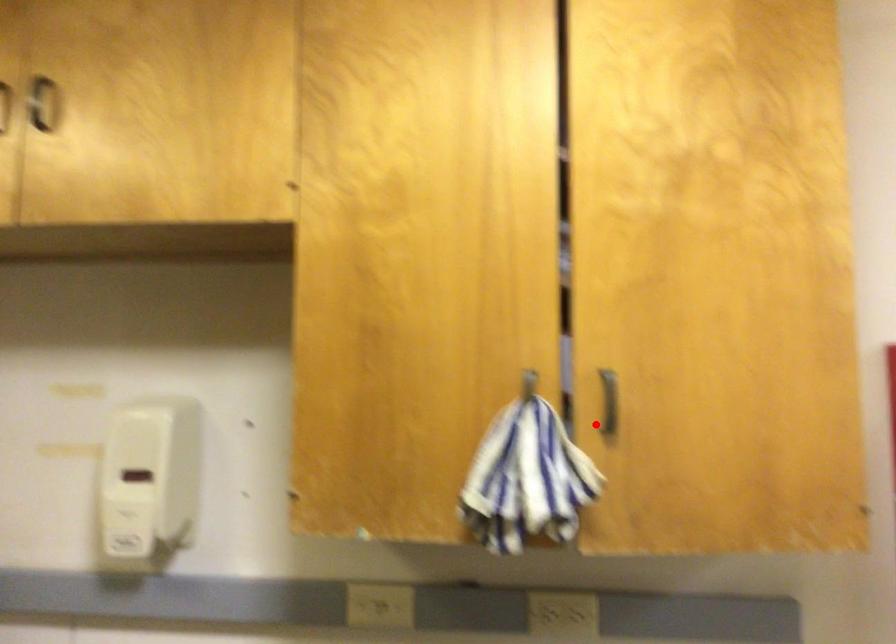
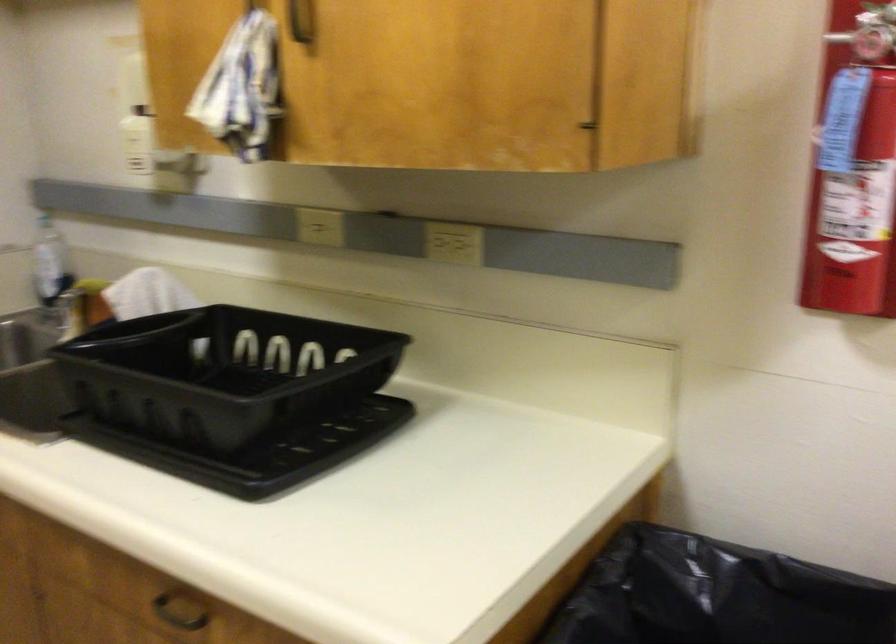
The point at the highlighted location is marked in the first image. Where is the corresponding point in the second image?

(299, 21)